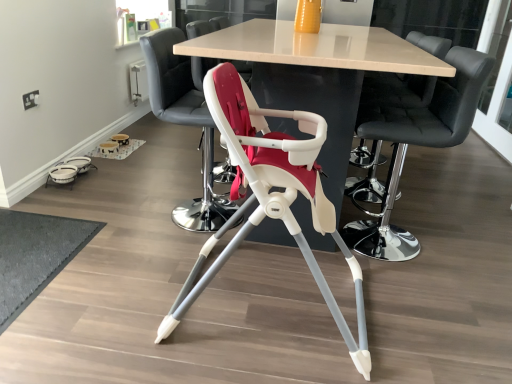
Image resolution: width=512 pixels, height=384 pixels. Find the location of `vacant area situated below black leather bar stool at upper center, the second chair from the right (from a real-world perspective)`. vacant area situated below black leather bar stool at upper center, the second chair from the right (from a real-world perspective) is located at coordinates (409, 241).